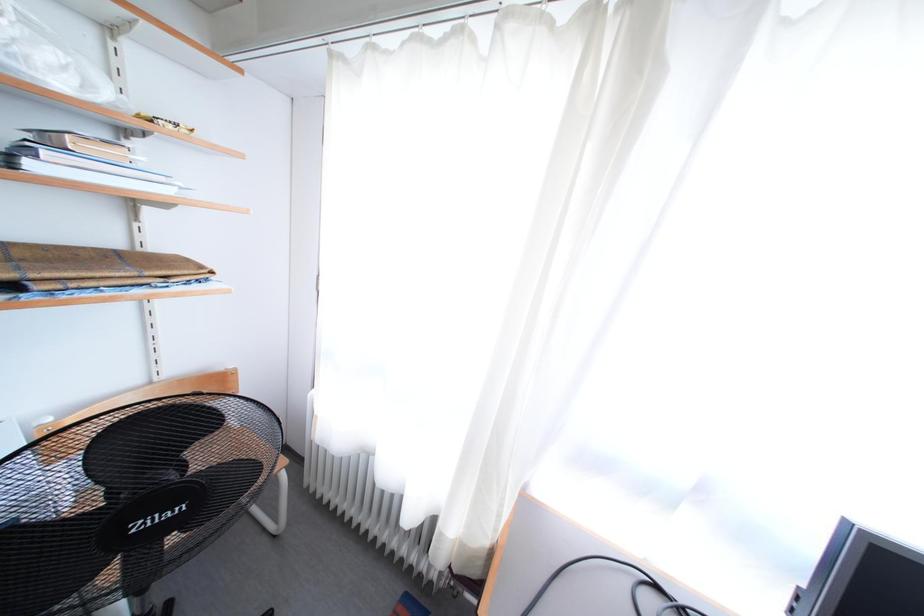
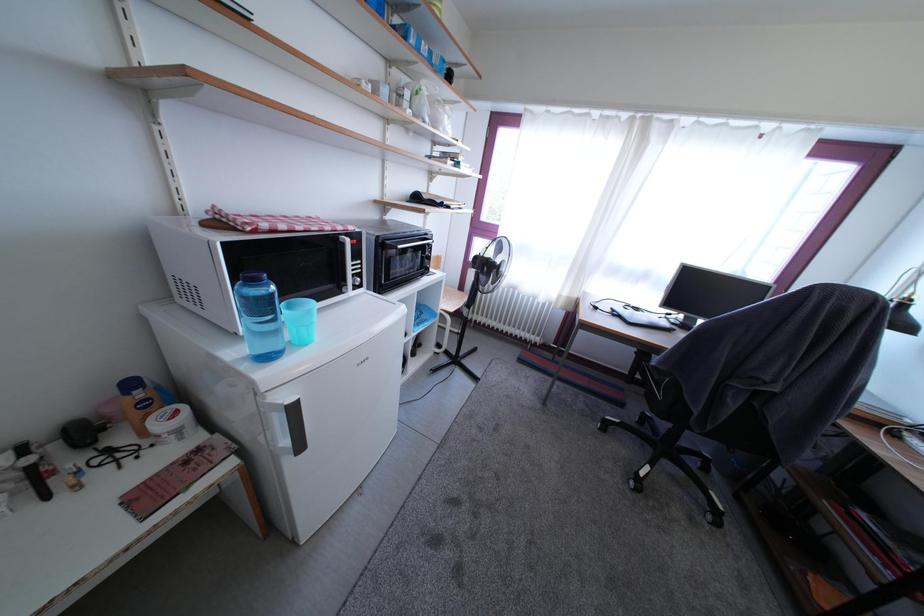
What movement of the cameraman would produce the second image?

The cameraman walked toward left, backward.